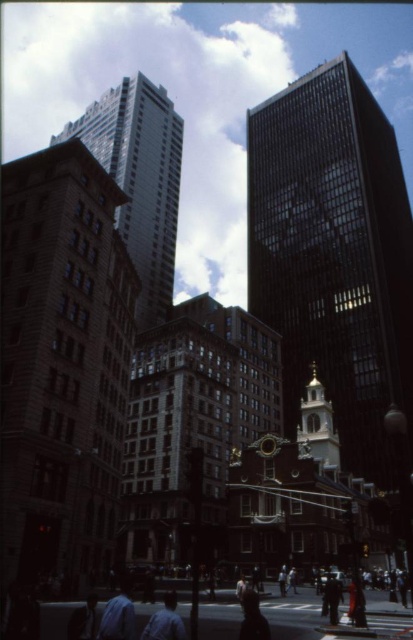
From the picture: You are standing in the bustling urban scene described. You see a denim jacket at lower right and a dark blue shirt at lower center. Which item is nearer to you?

The denim jacket at lower right is closer to the viewer than the dark blue shirt at lower center.

You are standing in the bustling urban scene with the Old State House and modern skyscrapers. You see two points marked in the image. Which point, point (372, 621) or point (246, 600), is closer to you?

Point (372, 621) is further to the viewer than point (246, 600), so point (246, 600) is closer to you.

You are a city planner who needs to install a new streetlight between the brown stone building at left and the gold dome Old State House. The streetlight has a coverage radius of 20 meters. Will the streetlight be able to illuminate both buildings?

The distance between the brown stone building at left and the gold dome Old State House is 44.84 meters. Since the streetlight has a coverage radius of 20 meters, it can only illuminate an area within 20 meters from its base. To cover both buildings, the total distance between them must be less than twice the coverage radius. However, 44.84 meters exceeds 40 meters, so the streetlight cannot illuminate both buildings simultaneously.